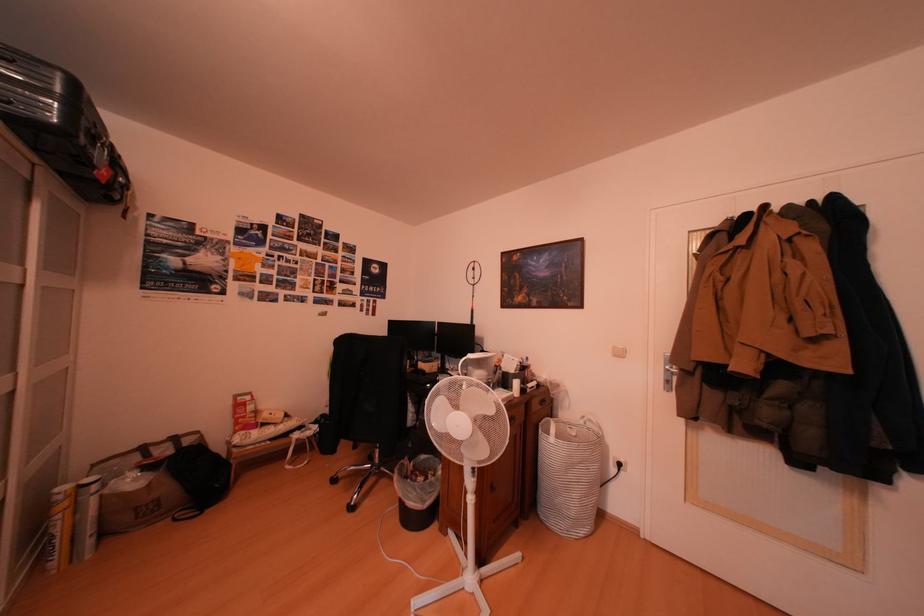
What do you see at coordinates (618, 351) in the screenshot? I see `a white light switch` at bounding box center [618, 351].